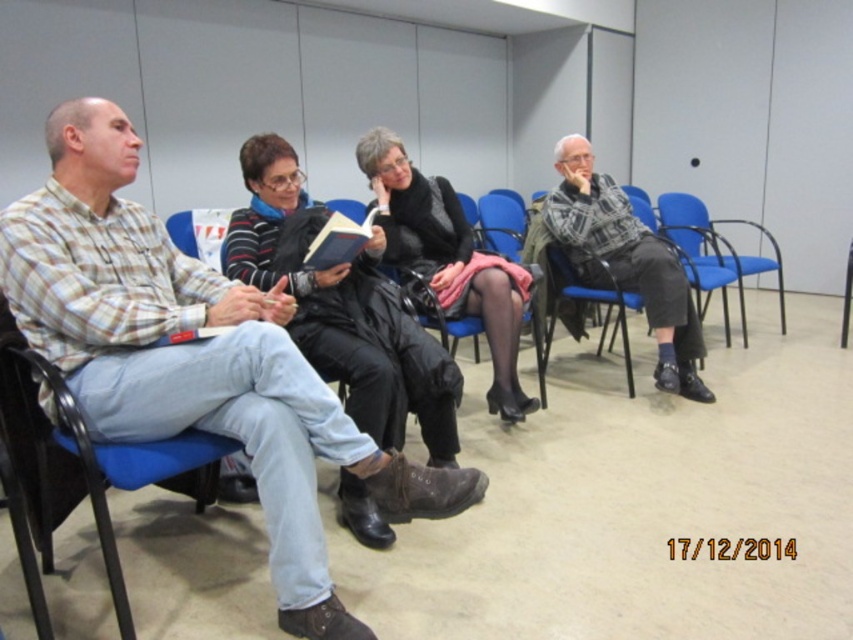
Question: Is the position of blue fabric chair at left less distant than that of blue plastic chair at center?

Choices:
 (A) yes
 (B) no

Answer: (A)

Question: Is plaid cotton shirt at left bigger than hardcover book at center?

Choices:
 (A) yes
 (B) no

Answer: (A)

Question: Does plaid cotton shirt at left lie in front of black leather jacket at center?

Choices:
 (A) no
 (B) yes

Answer: (B)

Question: Among these points, which one is farthest from the camera?

Choices:
 (A) (521, 413)
 (B) (682, 326)
 (C) (189, 289)

Answer: (B)

Question: Which point appears farthest from the camera in this image?

Choices:
 (A) (363, 246)
 (B) (192, 444)
 (C) (625, 269)

Answer: (C)

Question: Estimate the real-world distances between objects in this image. Which object is closer to the blue fabric chair at left?

Choices:
 (A) blue plastic chair at center
 (B) hardcover book at center
 (C) plaid cotton shirt at left
 (D) plaid wool sweater at center

Answer: (C)